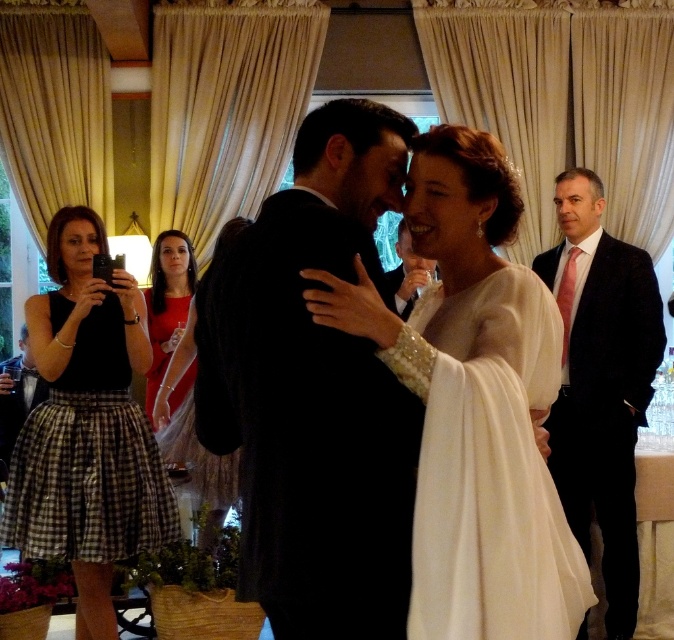
Question: Based on their relative distances, which object is nearer to the white satin dress at center?

Choices:
 (A) shiny red dress at center
 (B) matte black suit at right
 (C) matte black suit at center

Answer: (C)

Question: Is black checkered skirt at left bigger than shiny red dress at left?

Choices:
 (A) no
 (B) yes

Answer: (B)

Question: Which object is farther from the camera taking this photo?

Choices:
 (A) black satin suit at center
 (B) ivory satin dress at center
 (C) matte black suit at center
 (D) white satin dress at center

Answer: (C)

Question: Is ivory satin dress at center thinner than matte black suit at center?

Choices:
 (A) yes
 (B) no

Answer: (B)

Question: Is black satin suit at center to the left of black checkered skirt at left from the viewer's perspective?

Choices:
 (A) no
 (B) yes

Answer: (A)

Question: Which point is farther to the camera?

Choices:
 (A) (472, 449)
 (B) (415, 266)
 (C) (340, 109)
 (D) (173, 392)

Answer: (D)